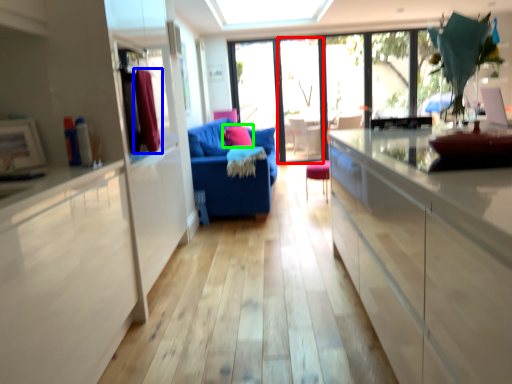
Question: Which object is positioned closest to screen door (highlighted by a red box)? Select from curtain (highlighted by a blue box) and pillow (highlighted by a green box).

Choices:
 (A) curtain
 (B) pillow

Answer: (B)